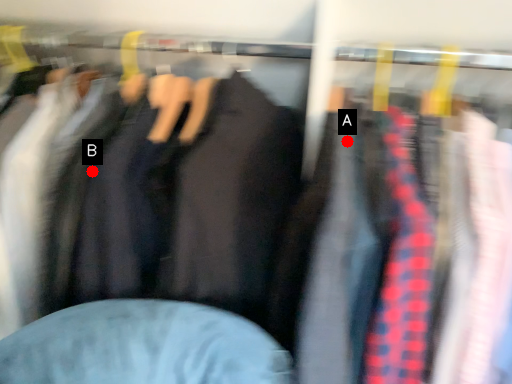
Question: Two points are circled on the image, labeled by A and B beside each circle. Which point is closer to the camera taking this photo?

Choices:
 (A) A is closer
 (B) B is closer

Answer: (A)